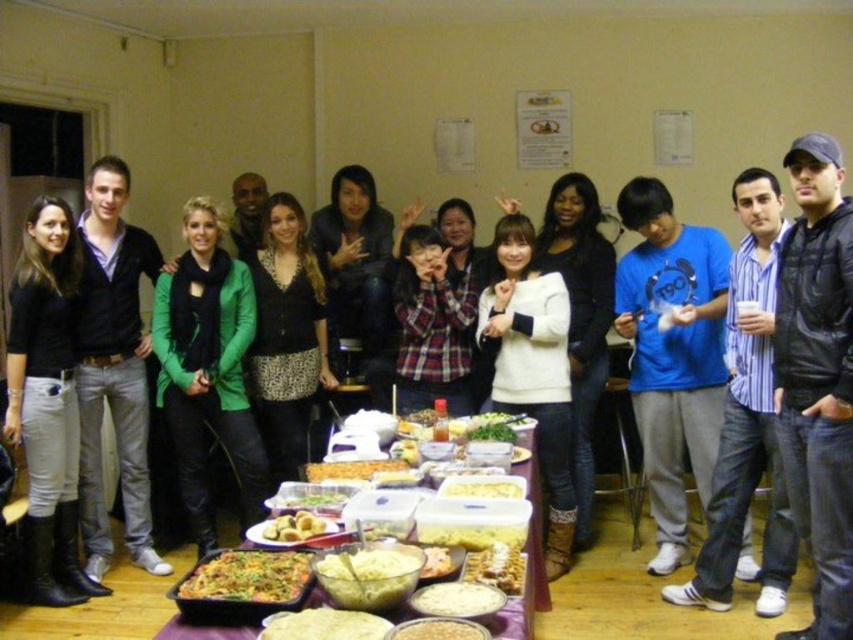
You are a GUI agent. You are given a task and a screenshot of the screen. Output one action in this format:
    pyautogui.click(x=<x>, y=<y>)
    Task: Click on the blue cotton shirt at center
    The image size is (853, 640).
    Given the screenshot: What is the action you would take?
    pyautogui.click(x=672, y=353)

Which is more to the right, blue cotton shirt at center or green matte jacket at center?

Positioned to the right is blue cotton shirt at center.

I want to click on blue cotton shirt at center, so click(672, 353).

Does golden crispy pastry at center have a larger size compared to green leafy vegetables at center?

Indeed, golden crispy pastry at center has a larger size compared to green leafy vegetables at center.

The height and width of the screenshot is (640, 853). What do you see at coordinates (351, 468) in the screenshot? I see `golden crispy pastry at center` at bounding box center [351, 468].

At what (x,y) coordinates should I click in order to perform the action: click on golden crispy pastry at center. Please return your answer as a coordinate pair (x, y). This screenshot has width=853, height=640. Looking at the image, I should click on (351, 468).

Who is taller, yellow matte casserole at center or white creamy pasta at center?

yellow matte casserole at center

Can you confirm if yellow matte casserole at center is taller than white creamy pasta at center?

Correct, yellow matte casserole at center is much taller as white creamy pasta at center.

The height and width of the screenshot is (640, 853). Find the location of `yellow matte casserole at center`. yellow matte casserole at center is located at coordinates (471, 534).

This screenshot has height=640, width=853. Identify the location of yellow matte casserole at center. (471, 534).